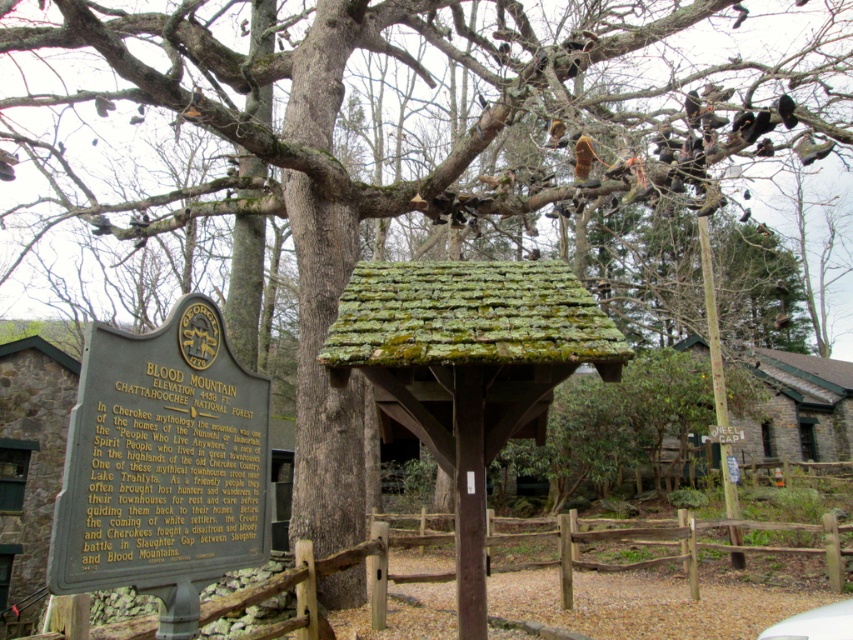
Question: Can you confirm if brown wooden fence at lower center is thinner than green mossy hut at right?

Choices:
 (A) no
 (B) yes

Answer: (B)

Question: In this image, where is green mossy wood hut at lower left located relative to brown wooden fence at lower center?

Choices:
 (A) below
 (B) above

Answer: (A)

Question: Observing the image, what is the correct spatial positioning of green mossy hut at right in reference to white matte car at lower right?

Choices:
 (A) right
 (B) left

Answer: (A)

Question: Which object is positioned farthest from the green mossy wood hut at lower left?

Choices:
 (A) brown wooden fence at lower center
 (B) green mossy hut at right

Answer: (B)

Question: Among these objects, which one is nearest to the camera?

Choices:
 (A) green mossy hut at right
 (B) brown wooden fence at lower center

Answer: (B)

Question: Which object is closer to the camera taking this photo?

Choices:
 (A) brown wooden fence at lower center
 (B) green mossy hut at right

Answer: (A)